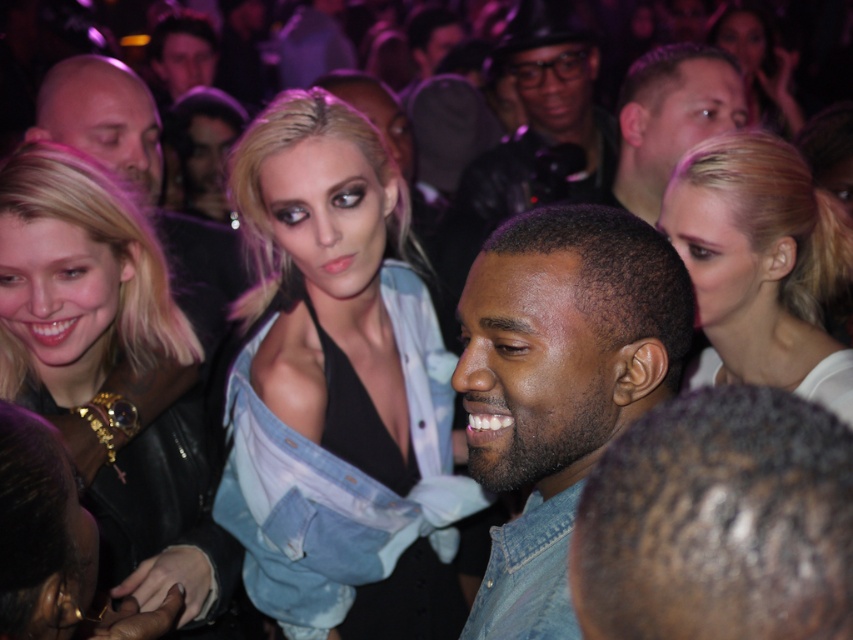
You are at a concert and want to know if the matte black leather jacket at center left can fit into a bag that can only hold items narrower than the light brown hair at upper center. Can it fit?

The matte black leather jacket at center left is wider than the light brown hair at upper center, so it cannot fit into the bag since the jacket is wider than the allowed width based on the hair.

You are a photographer at the event and want to capture a photo that includes both the matte black leather jacket at center left and the light brown hair at upper center. Considering their sizes, which object should you focus on to ensure both fit in the frame?

The matte black leather jacket at center left is bigger than the light brown hair at upper center, so focusing on the matte black leather jacket at center left would ensure both fit in the frame since it takes up more space.